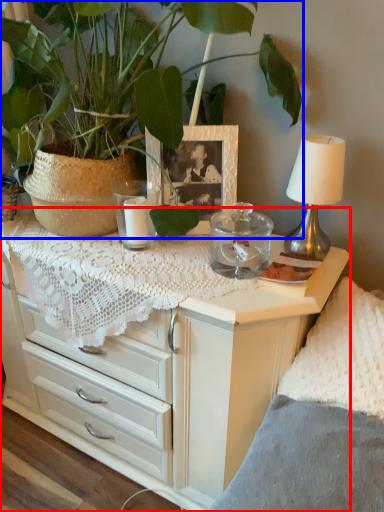
Question: Which object is closer to the camera taking this photo, chest of drawers (highlighted by a red box) or houseplant (highlighted by a blue box)?

Choices:
 (A) chest of drawers
 (B) houseplant

Answer: (B)